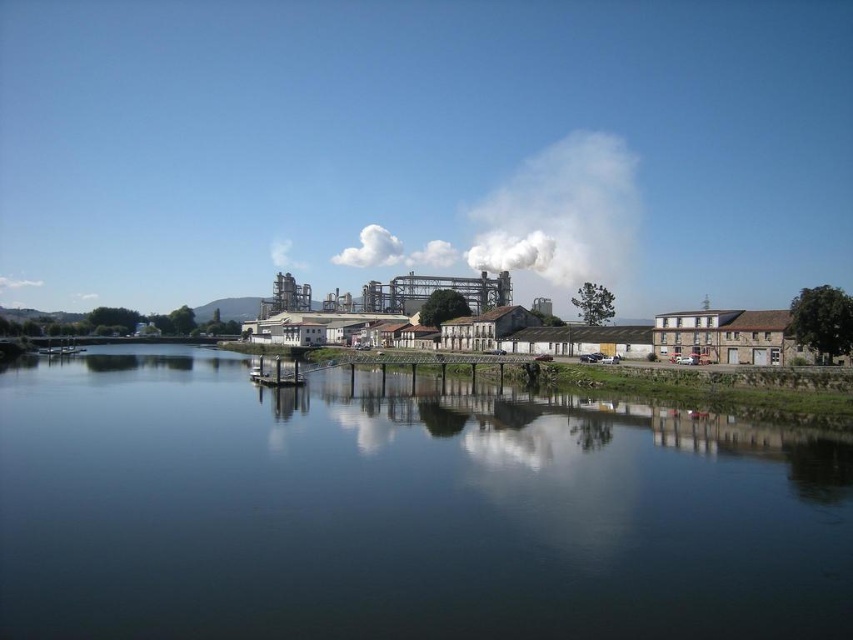
Can you confirm if dark blue water at center is bigger than white smoke at upper center?

No.

What are the coordinates of `dark blue water at center` in the screenshot? It's located at (401, 509).

Identify the location of dark blue water at center. The image size is (853, 640). (401, 509).